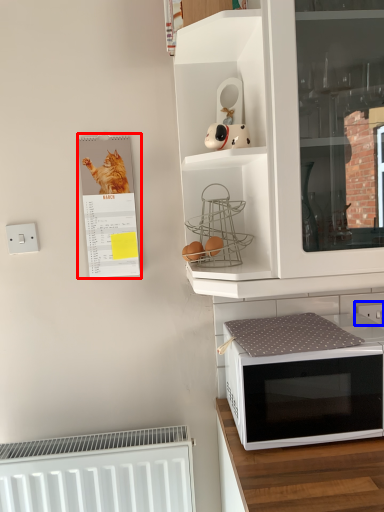
Question: Which of the following is the farthest to the observer, bulletin board (highlighted by a red box) or electric outlet (highlighted by a blue box)?

Choices:
 (A) bulletin board
 (B) electric outlet

Answer: (B)